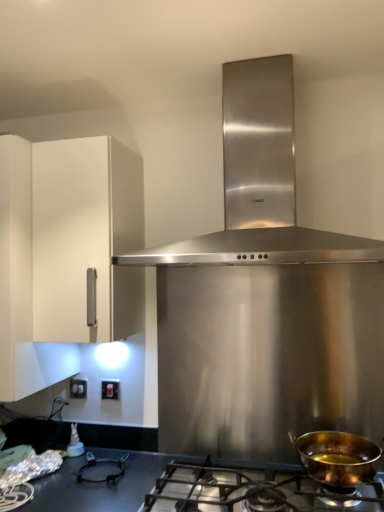
Measure the distance between white matte cabinet at left and camera.

A distance of 4.73 feet exists between white matte cabinet at left and camera.

What do you see at coordinates (337, 457) in the screenshot? I see `shiny copper pan at lower right` at bounding box center [337, 457].

The width and height of the screenshot is (384, 512). Describe the element at coordinates (110, 389) in the screenshot. I see `matte black switch at lower left, the first electric outlet when ordered from right to left` at that location.

Describe the element at coordinates (78, 388) in the screenshot. I see `white plastic electric outlet at lower left, acting as the 1th electric outlet starting from the left` at that location.

What do you see at coordinates (329, 160) in the screenshot?
I see `stainless steel range hood at center` at bounding box center [329, 160].

The image size is (384, 512). Find the location of `white matte cabinet at left`. white matte cabinet at left is located at coordinates (86, 238).

Is the depth of white matte cabinet at left greater than that of shiny copper pan at lower right?

Yes, white matte cabinet at left is further from the camera.

Could shiny copper pan at lower right be considered to be inside white matte cabinet at left?

No, shiny copper pan at lower right is not inside white matte cabinet at left.

Locate an element on the screen. Image resolution: width=384 pixels, height=512 pixels. kitchen appliance that is under the white matte cabinet at left (from a real-world perspective) is located at coordinates (337, 457).

Considering the sizes of objects white matte cabinet at left and shiny copper pan at lower right in the image provided, who is wider, white matte cabinet at left or shiny copper pan at lower right?

white matte cabinet at left.

Does white plastic electric outlet at lower left, which is the 1th electric outlet in back-to-front order, turn towards stainless steel range hood at center?

No, white plastic electric outlet at lower left, which is the 1th electric outlet in back-to-front order, is not facing towards stainless steel range hood at center.

Between point (79, 394) and point (331, 185), which one is positioned in front?

The point (331, 185) is in front.

In the scene shown: Is white plastic electric outlet at lower left, which is the second electric outlet from front to back, located outside stainless steel range hood at center?

white plastic electric outlet at lower left, which is the second electric outlet from front to back, lies outside stainless steel range hood at center's area.

From the image's perspective, is white plastic electric outlet at lower left, the second electric outlet in the right-to-left sequence, located above stainless steel range hood at center?

No, from the image's perspective, white plastic electric outlet at lower left, the second electric outlet in the right-to-left sequence, is not over stainless steel range hood at center.

Can you confirm if white matte cabinet at left is shorter than white plastic electric outlet at lower left, the second electric outlet in the right-to-left sequence?

No.

Which electric outlet is the 2nd one when counting from the back of the white matte cabinet at left? Please provide its 2D coordinates.

[(78, 388)]

Is white matte cabinet at left aimed at white plastic electric outlet at lower left, acting as the 1th electric outlet starting from the left?

No, white matte cabinet at left is not facing towards white plastic electric outlet at lower left, acting as the 1th electric outlet starting from the left.

Which is behind, white matte cabinet at left or white plastic electric outlet at lower left, the second electric outlet in the right-to-left sequence?

white plastic electric outlet at lower left, the second electric outlet in the right-to-left sequence.

From the picture: Which object is positioned more to the right, shiny metallic gas stove at lower center or matte black switch at lower left, marked as the second electric outlet in a left-to-right arrangement?

Positioned to the right is shiny metallic gas stove at lower center.

From the image's perspective, is shiny metallic gas stove at lower center beneath matte black switch at lower left, marked as the second electric outlet in a left-to-right arrangement?

Yes, from the image's perspective, shiny metallic gas stove at lower center is beneath matte black switch at lower left, marked as the second electric outlet in a left-to-right arrangement.

From a real-world perspective, is shiny metallic gas stove at lower center positioned above or below matte black switch at lower left, the first electric outlet when ordered from right to left?

In terms of real-world spatial position, shiny metallic gas stove at lower center is below matte black switch at lower left, the first electric outlet when ordered from right to left.

Which object is further away from the camera taking this photo, shiny metallic gas stove at lower center or matte black switch at lower left, the 1th electric outlet viewed from the front?

matte black switch at lower left, the 1th electric outlet viewed from the front, is more distant.

Are white plastic electric outlet at lower left, acting as the 1th electric outlet starting from the left, and shiny copper pan at lower right making contact?

No, white plastic electric outlet at lower left, acting as the 1th electric outlet starting from the left, is not in contact with shiny copper pan at lower right.

In the image, is white plastic electric outlet at lower left, the second electric outlet in the right-to-left sequence, positioned in front of or behind shiny copper pan at lower right?

Clearly, white plastic electric outlet at lower left, the second electric outlet in the right-to-left sequence, is behind shiny copper pan at lower right.

Considering the relative sizes of white plastic electric outlet at lower left, which is the second electric outlet from front to back, and shiny copper pan at lower right in the image provided, is white plastic electric outlet at lower left, which is the second electric outlet from front to back, wider than shiny copper pan at lower right?

In fact, white plastic electric outlet at lower left, which is the second electric outlet from front to back, might be narrower than shiny copper pan at lower right.

Measure the distance from white plastic electric outlet at lower left, acting as the 1th electric outlet starting from the left, to shiny copper pan at lower right.

3.34 feet.

Based on their sizes in the image, would you say white matte cabinet at left is bigger or smaller than shiny metallic gas stove at lower center?

Considering their sizes, white matte cabinet at left takes up more space than shiny metallic gas stove at lower center.

Is white matte cabinet at left facing towards shiny metallic gas stove at lower center?

No, white matte cabinet at left is not facing towards shiny metallic gas stove at lower center.

From a real-world perspective, which object rests below the other?

From a 3D spatial view, shiny metallic gas stove at lower center is below.

Considering the sizes of shiny copper pan at lower right and stainless steel range hood at center in the image, is shiny copper pan at lower right bigger or smaller than stainless steel range hood at center?

In the image, shiny copper pan at lower right appears to be smaller than stainless steel range hood at center.

Between shiny copper pan at lower right and stainless steel range hood at center, which one appears on the right side from the viewer's perspective?

shiny copper pan at lower right.

Is stainless steel range hood at center inside shiny copper pan at lower right?

No, stainless steel range hood at center is located outside of shiny copper pan at lower right.

In the scene shown: Is shiny copper pan at lower right further to camera compared to stainless steel range hood at center?

Yes.

I want to click on cabinetry above the shiny copper pan at lower right (from the image's perspective), so click(x=86, y=238).

Identify the location of home appliance lying in front of the white plastic electric outlet at lower left, acting as the 1th electric outlet starting from the left. The width and height of the screenshot is (384, 512). (329, 160).

Looking at the image, which one is located further to shiny copper pan at lower right, matte black switch at lower left, marked as the second electric outlet in a left-to-right arrangement, or stainless steel range hood at center?

Based on the image, stainless steel range hood at center appears to be further to shiny copper pan at lower right.

Considering their positions, is white matte cabinet at left positioned closer to stainless steel range hood at center than matte black switch at lower left, the 1th electric outlet viewed from the front?

white matte cabinet at left is positioned closer to the anchor stainless steel range hood at center.

Looking at the image, which one is located further to shiny metallic gas stove at lower center, stainless steel range hood at center or shiny copper pan at lower right?

stainless steel range hood at center is further to shiny metallic gas stove at lower center.

Estimate the real-world distances between objects in this image. Which object is further from matte black switch at lower left, marked as the second electric outlet in a left-to-right arrangement, stainless steel range hood at center or white matte cabinet at left?

stainless steel range hood at center lies further to matte black switch at lower left, marked as the second electric outlet in a left-to-right arrangement, than the other object.

Considering their positions, is white plastic electric outlet at lower left, which is the second electric outlet from front to back, positioned further to stainless steel range hood at center than matte black switch at lower left, the 1th electric outlet viewed from the front?

Based on the image, white plastic electric outlet at lower left, which is the second electric outlet from front to back, appears to be further to stainless steel range hood at center.

Estimate the real-world distances between objects in this image. Which object is closer to white plastic electric outlet at lower left, the second electric outlet in the right-to-left sequence, shiny metallic gas stove at lower center or shiny copper pan at lower right?

shiny metallic gas stove at lower center lies closer to white plastic electric outlet at lower left, the second electric outlet in the right-to-left sequence, than the other object.

Based on their spatial positions, is stainless steel range hood at center or shiny metallic gas stove at lower center closer to white matte cabinet at left?

stainless steel range hood at center lies closer to white matte cabinet at left than the other object.

Consider the image. Based on their spatial positions, is shiny metallic gas stove at lower center or matte black switch at lower left, the first electric outlet when ordered from right to left, further from white matte cabinet at left?

shiny metallic gas stove at lower center is further to white matte cabinet at left.

The height and width of the screenshot is (512, 384). What are the coordinates of `kitchen appliance between stainless steel range hood at center and shiny metallic gas stove at lower center from top to bottom` in the screenshot? It's located at (337, 457).

Where is `electric outlet between shiny metallic gas stove at lower center and white plastic electric outlet at lower left, which is the second electric outlet from front to back, in the front-back direction`? This screenshot has width=384, height=512. electric outlet between shiny metallic gas stove at lower center and white plastic electric outlet at lower left, which is the second electric outlet from front to back, in the front-back direction is located at coordinates (110, 389).

Identify the location of cabinetry between stainless steel range hood at center and matte black switch at lower left, the 1th electric outlet viewed from the front, vertically. This screenshot has height=512, width=384. (86, 238).

In order to click on gas stove between white matte cabinet at left and shiny copper pan at lower right in this screenshot , I will do `click(253, 490)`.